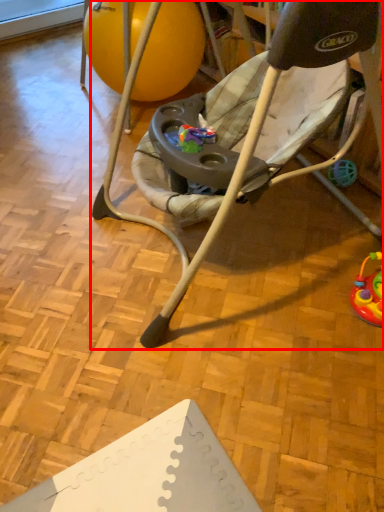
Question: From the image's perspective, what is the correct spatial positioning of chair (annotated by the red box) in reference to ball?

Choices:
 (A) below
 (B) above

Answer: (A)